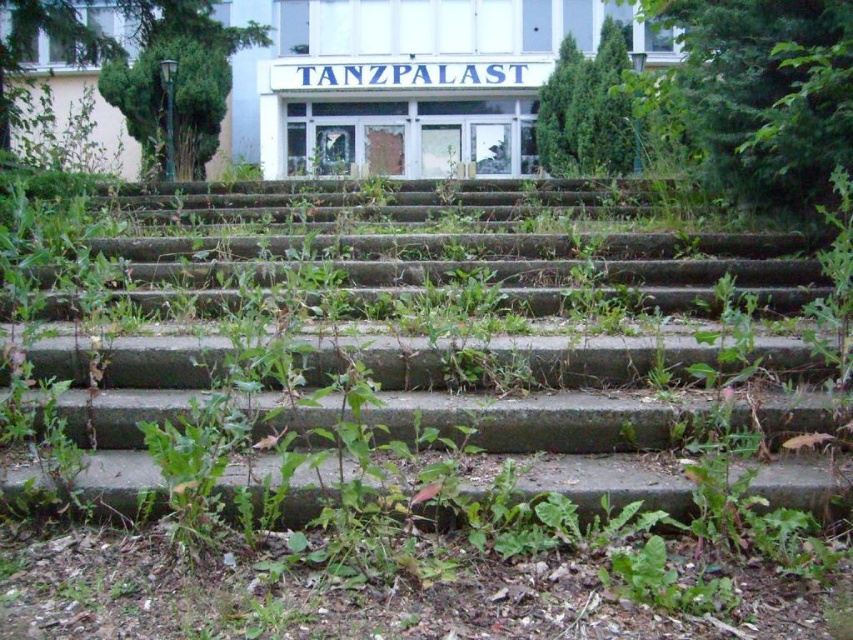
At what (x,y) coordinates should I click in order to perform the action: click on green concrete stairs at center. Please return your answer as a coordinate pair (x, y). Looking at the image, I should click on (485, 266).

Is green concrete stairs at center in front of green leafy shrub at upper center?

Yes.

Between point (105, 440) and point (566, 68), which one is positioned behind?

Positioned behind is point (566, 68).

I want to click on green concrete stairs at center, so click(485, 266).